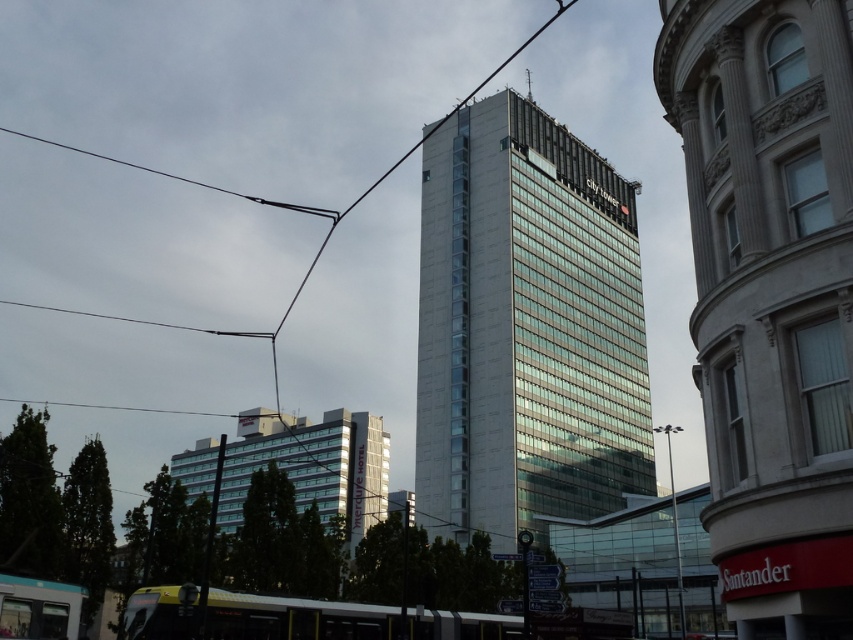
You are a pedestrian standing at the intersection near the metallic silver bus at lower center and the black wire at upper left. Which object is closer to the ground?

The metallic silver bus at lower center is closer to the ground than the black wire at upper left.

You are a city planner analyzing the urban layout. Given the dimensions provided, can the metallic silver bus at lower center fit entirely within the width of the matte glass building at center?

The matte glass building at center is wider than the metallic silver bus at lower center, so the bus can fit within the building width.

You are a pedestrian standing at the tram stop near the tram tracks and overhead wires in the foreground. You want to take a photo of the City Tower skyscraper. However, the metallic silver bus at lower center is blocking your view. Can you move to the left or right to avoid the bus while still seeing the matte glass building at center?

The metallic silver bus at lower center is behind the matte glass building at center, so moving to the left or right might allow you to see around the bus while still keeping the matte glass building at center in view.